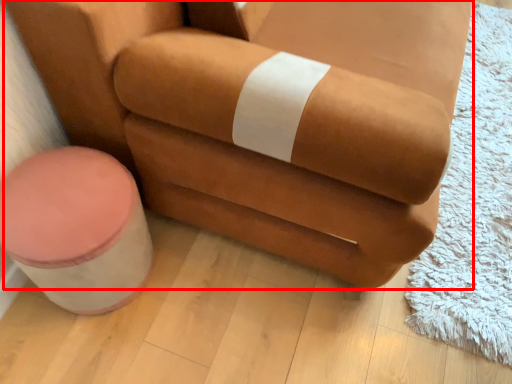
Question: Where is chair (annotated by the red box) located in relation to stool in the image?

Choices:
 (A) right
 (B) left

Answer: (A)